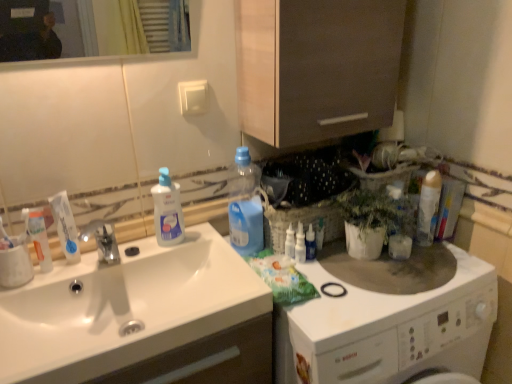
Identify the location of vacant area that is in front of transparent plastic bottle at upper right. (331, 285).